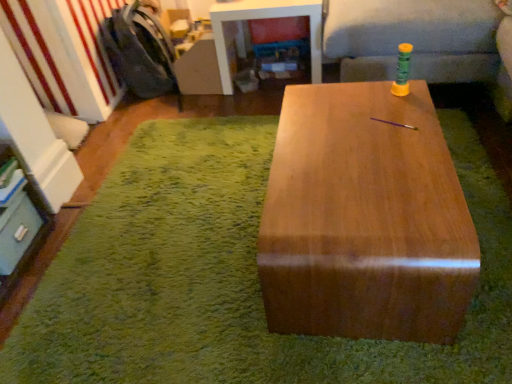
Question: Is matte gray drawer at lower left not near dark gray fabric armchair at left?

Choices:
 (A) no
 (B) yes

Answer: (B)

Question: Is matte gray drawer at lower left to the left of dark gray fabric armchair at left from the viewer's perspective?

Choices:
 (A) yes
 (B) no

Answer: (A)

Question: Is matte gray drawer at lower left looking in the opposite direction of dark gray fabric armchair at left?

Choices:
 (A) yes
 (B) no

Answer: (B)

Question: Can you confirm if matte gray drawer at lower left is thinner than dark gray fabric armchair at left?

Choices:
 (A) yes
 (B) no

Answer: (A)

Question: Does matte gray drawer at lower left appear on the right side of dark gray fabric armchair at left?

Choices:
 (A) no
 (B) yes

Answer: (A)

Question: Considering their positions, is green fabric couch at upper right located in front of or behind matte gray drawer at lower left?

Choices:
 (A) front
 (B) behind

Answer: (B)

Question: Does point (352, 9) appear closer or farther from the camera than point (0, 248)?

Choices:
 (A) closer
 (B) farther

Answer: (B)

Question: Looking at their shapes, would you say green fabric couch at upper right is wider or thinner than matte gray drawer at lower left?

Choices:
 (A) thin
 (B) wide

Answer: (B)

Question: In terms of size, does green fabric couch at upper right appear bigger or smaller than matte gray drawer at lower left?

Choices:
 (A) big
 (B) small

Answer: (A)

Question: From a real-world perspective, is green fabric couch at upper right physically located above or below dark gray fabric armchair at left?

Choices:
 (A) below
 (B) above

Answer: (B)

Question: Is green fabric couch at upper right taller or shorter than dark gray fabric armchair at left?

Choices:
 (A) tall
 (B) short

Answer: (A)

Question: Does point (432, 6) appear closer or farther from the camera than point (159, 61)?

Choices:
 (A) farther
 (B) closer

Answer: (B)

Question: Based on their sizes in the image, would you say green fabric couch at upper right is bigger or smaller than dark gray fabric armchair at left?

Choices:
 (A) big
 (B) small

Answer: (A)

Question: From the image's perspective, is dark gray fabric armchair at left positioned above or below green fabric couch at upper right?

Choices:
 (A) below
 (B) above

Answer: (A)

Question: Visually, is dark gray fabric armchair at left positioned to the left or to the right of green fabric couch at upper right?

Choices:
 (A) left
 (B) right

Answer: (A)